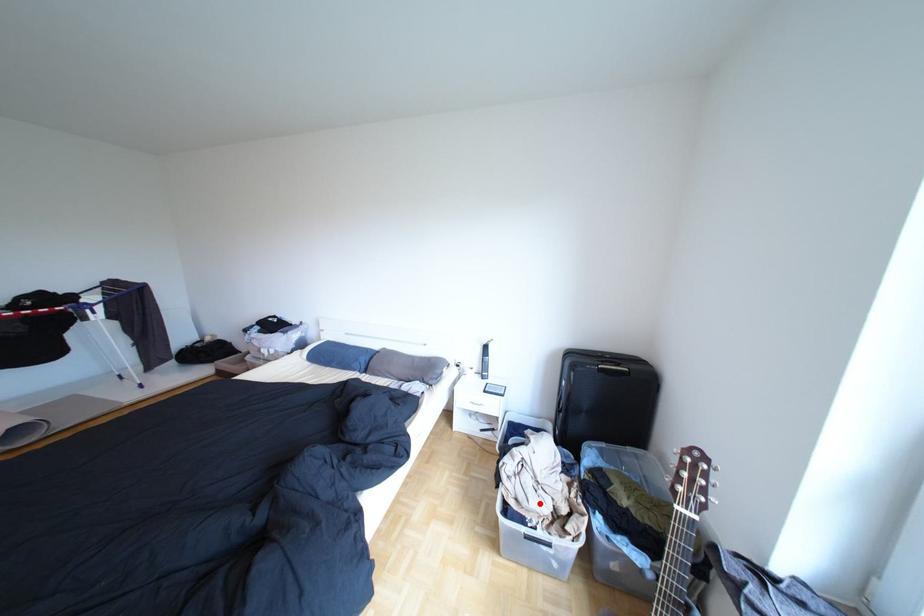
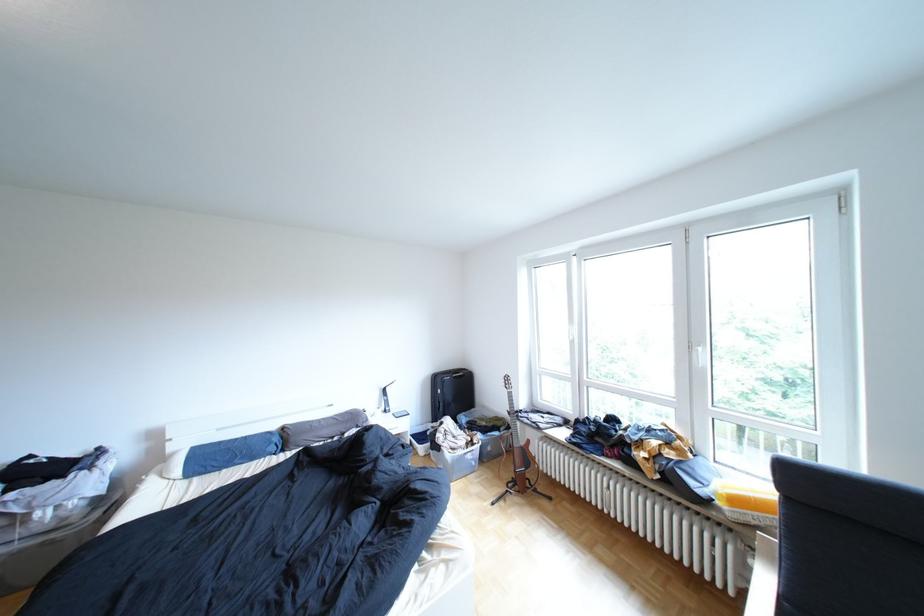
Question: I am providing you with two images of the same scene from different viewpoints. A red point is marked on the first image. At the location where the point appears in image 1, is it still visible in image 2?

Choices:
 (A) Yes
 (B) No

Answer: (A)